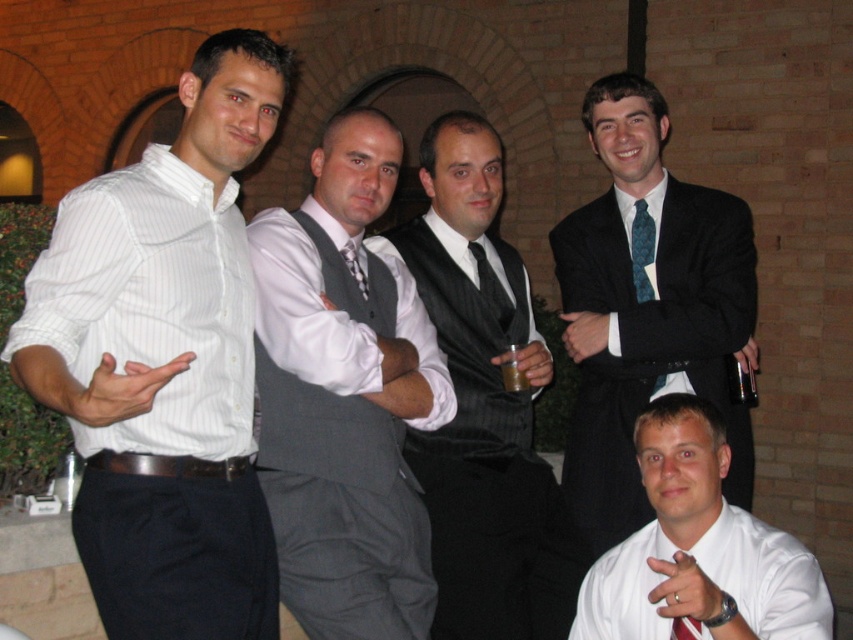
Question: Is white glossy shirt at center smaller than black pinstripe tie at center?

Choices:
 (A) no
 (B) yes

Answer: (A)

Question: In this image, where is teal textured tie at right located relative to black pinstripe tie at center?

Choices:
 (A) below
 (B) above

Answer: (B)

Question: Among these points, which one is farthest from the camera?

Choices:
 (A) (635, 616)
 (B) (468, 244)

Answer: (B)

Question: Which object is farther from the camera taking this photo?

Choices:
 (A) white striped shirt at left
 (B) matte black vest at center
 (C) red silk tie at lower right

Answer: (B)

Question: Which of these objects is positioned farthest from the red silk tie at lower right?

Choices:
 (A) black pinstripe tie at center
 (B) dark blue suit at upper right

Answer: (A)

Question: Does white striped shirt at left have a lesser width compared to white glossy shirt at center?

Choices:
 (A) no
 (B) yes

Answer: (B)